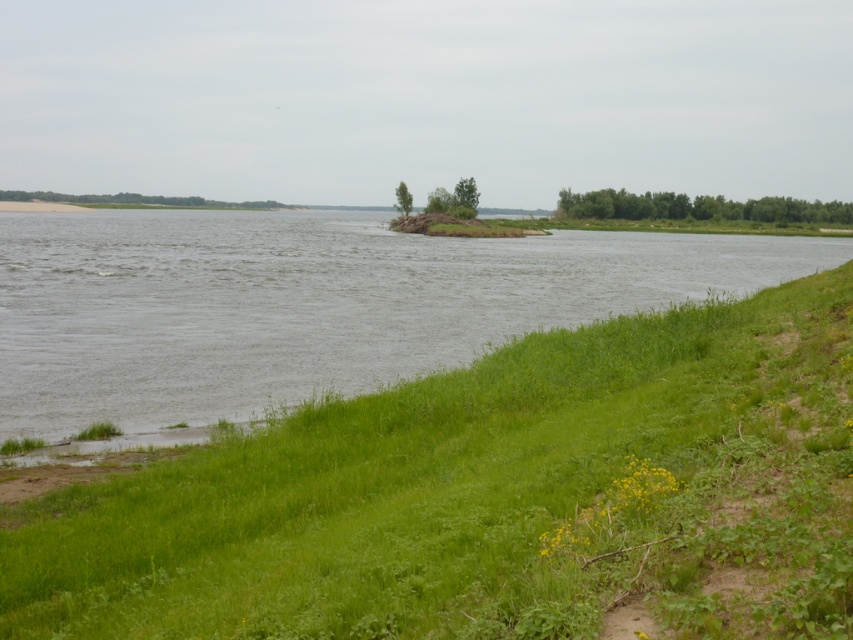
Question: Is green grassy at lower left further to the viewer compared to gray water at center?

Choices:
 (A) no
 (B) yes

Answer: (A)

Question: Can you confirm if green grassy at lower left is smaller than gray water at center?

Choices:
 (A) no
 (B) yes

Answer: (B)

Question: Is green grassy at lower left wider than gray water at center?

Choices:
 (A) yes
 (B) no

Answer: (B)

Question: Which object is closer to the camera taking this photo?

Choices:
 (A) green grassy at lower left
 (B) gray water at center

Answer: (A)